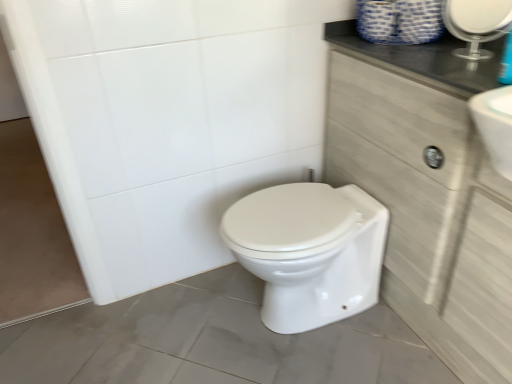
Question: Based on their positions, is white glossy bidet at center located to the left or right of light wood cabinet at right?

Choices:
 (A) right
 (B) left

Answer: (B)

Question: Is white glossy bidet at center in front of or behind light wood cabinet at right in the image?

Choices:
 (A) behind
 (B) front

Answer: (A)

Question: Based on their relative distances, which object is nearer to the white glossy bidet at center?

Choices:
 (A) clear glass mirror at upper right
 (B) light wood cabinet at right

Answer: (B)

Question: Estimate the real-world distances between objects in this image. Which object is farther from the clear glass mirror at upper right?

Choices:
 (A) white glossy bidet at center
 (B) light wood cabinet at right

Answer: (A)